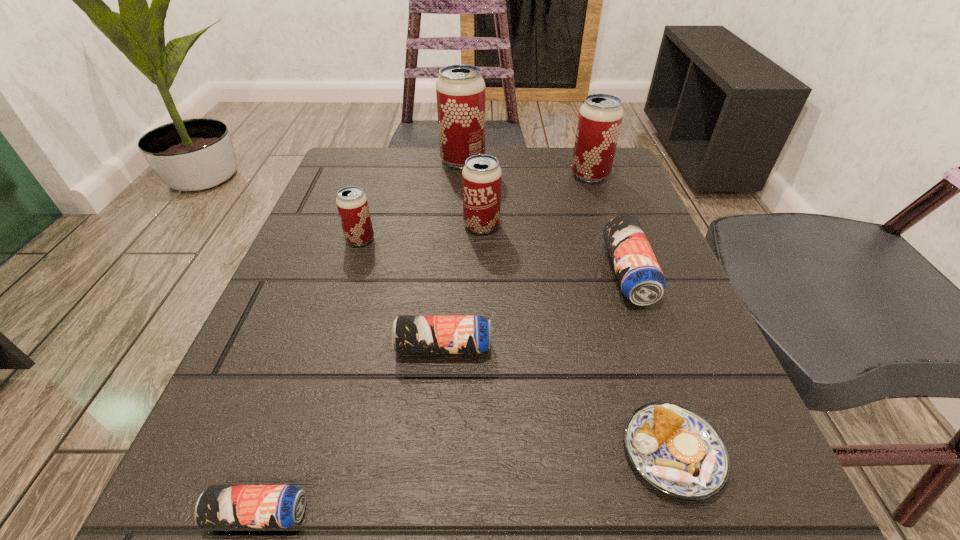
You are a GUI agent. You are given a task and a screenshot of the screen. Output one action in this format:
    pyautogui.click(x=<x>, y=<y>)
    Task: Click on the free space between the leftmost blue beer can and the fourth shortest beer can
    The height and width of the screenshot is (540, 960).
    Given the screenshot: What is the action you would take?
    pyautogui.click(x=309, y=376)

Where is `vacant area between the fifth tallest beer can and the pastry`? vacant area between the fifth tallest beer can and the pastry is located at coordinates (651, 363).

The height and width of the screenshot is (540, 960). What are the coordinates of `vacant area between the pastry and the third shortest object` in the screenshot? It's located at (558, 400).

Identify the location of free spot between the leftmost red beer can and the sixth shortest object. This screenshot has width=960, height=540. (421, 232).

Locate an element on the screen. vacant space that's between the brown pastry and the rightmost red beer can is located at coordinates (632, 314).

Choose which object is the sixth nearest neighbor to the fourth tallest object. Please provide its 2D coordinates. Your answer should be formatted as a tuple, i.e. [(x, y)], where the tuple contains the x and y coordinates of a point satisfying the conditions above.

[(600, 117)]

This screenshot has width=960, height=540. Identify the location of object that is the fourth closest to the fourth tallest beer can. (641, 280).

At what (x,y) coordinates should I click in order to perform the action: click on beer can that stands as the second closest to the brown pastry. Please return your answer as a coordinate pair (x, y). This screenshot has height=540, width=960. Looking at the image, I should click on (x=641, y=280).

Select which beer can appears as the third closest to the fifth shortest object. Please provide its 2D coordinates. Your answer should be formatted as a tuple, i.e. [(x, y)], where the tuple contains the x and y coordinates of a point satisfying the conditions above.

[(460, 89)]

Identify the location of red beer can that is the third closest to the biggest blue beer can. (460, 89).